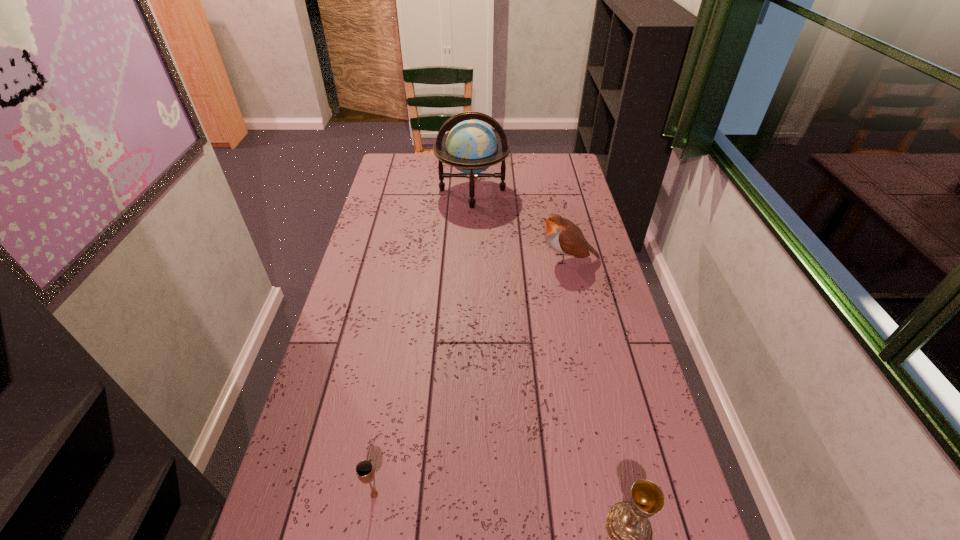
In order to click on vacant area that lies between the shorter chalice and the bird in this screenshot , I will do pos(471,377).

Locate an element on the screen. Image resolution: width=960 pixels, height=540 pixels. free spot between the tallest object and the third nearest object is located at coordinates (520, 225).

The image size is (960, 540). Identify the location of vacant area between the leftmost object and the third nearest object. pos(471,377).

The height and width of the screenshot is (540, 960). I want to click on object that is the third nearest to the shorter chalice, so click(x=471, y=146).

You are a GUI agent. You are given a task and a screenshot of the screen. Output one action in this format:
    pyautogui.click(x=<x>, y=<y>)
    Task: Click on the second closest object to the bird
    This screenshot has width=960, height=540.
    Given the screenshot: What is the action you would take?
    pyautogui.click(x=628, y=526)